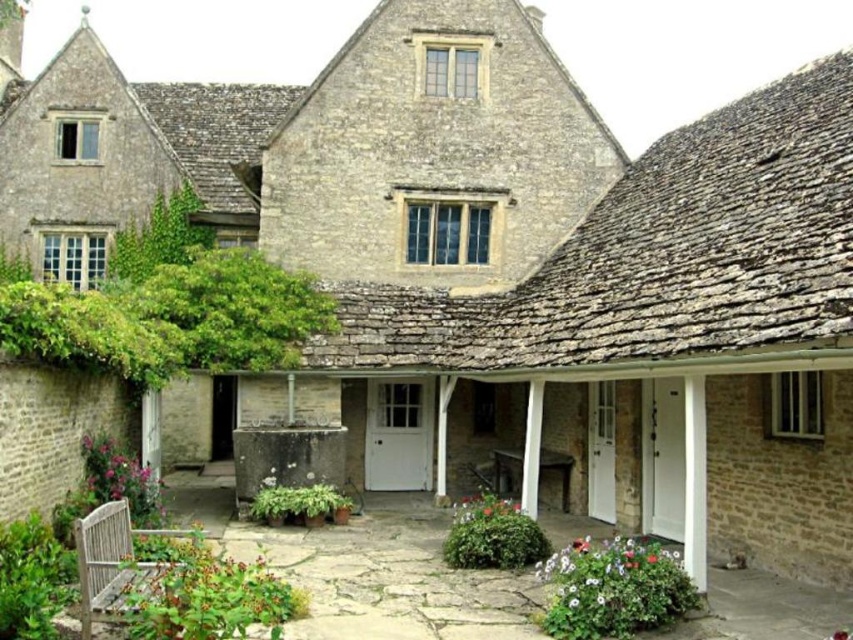
Question: Is green leafy bush at center further to the viewer compared to green leafy plant at center?

Choices:
 (A) yes
 (B) no

Answer: (B)

Question: Does green leafy plant at lower left have a lesser width compared to green leafy bush at center?

Choices:
 (A) no
 (B) yes

Answer: (A)

Question: Which of the following is the farthest from the observer?

Choices:
 (A) green leafy plant at center
 (B) green leafy bush at lower left

Answer: (A)

Question: Among these points, which one is farthest from the camera?

Choices:
 (A) (306, 492)
 (B) (25, 602)
 (C) (631, 561)

Answer: (A)

Question: Which point appears farthest from the camera in this image?

Choices:
 (A) (630, 595)
 (B) (51, 614)
 (C) (163, 564)
 (D) (538, 545)

Answer: (D)

Question: Does fluffy green bush at lower right come behind green leafy bush at lower left?

Choices:
 (A) yes
 (B) no

Answer: (A)